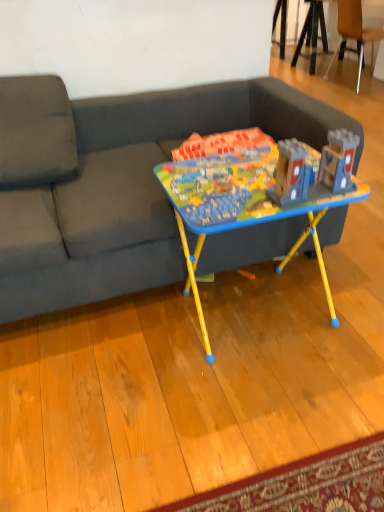
Find the location of a particular element. vacant location below matte plastic table at center (from a real-world perspective) is located at coordinates (247, 309).